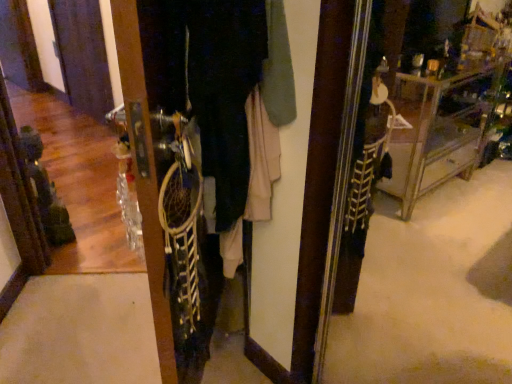
Question: Is white fabric dreamcatcher at center situated inside matte black screen door at left or outside?

Choices:
 (A) outside
 (B) inside

Answer: (A)

Question: Is point (129, 104) closer or farther from the camera than point (76, 89)?

Choices:
 (A) closer
 (B) farther

Answer: (A)

Question: Looking at their shapes, would you say white fabric dreamcatcher at center is wider or thinner than matte black screen door at left?

Choices:
 (A) wide
 (B) thin

Answer: (A)

Question: Is matte black screen door at left situated inside white fabric dreamcatcher at center or outside?

Choices:
 (A) inside
 (B) outside

Answer: (B)

Question: From their relative heights in the image, would you say matte black screen door at left is taller or shorter than white fabric dreamcatcher at center?

Choices:
 (A) short
 (B) tall

Answer: (B)

Question: Considering their positions, is matte black screen door at left located in front of or behind white fabric dreamcatcher at center?

Choices:
 (A) behind
 (B) front

Answer: (A)

Question: Is point (100, 56) positioned closer to the camera than point (147, 16)?

Choices:
 (A) closer
 (B) farther

Answer: (B)